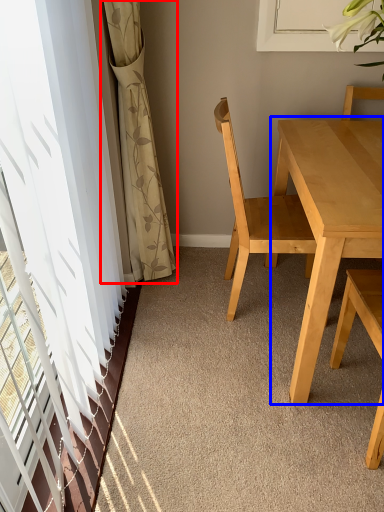
Question: Which object is further to the camera taking this photo, curtain (highlighted by a red box) or kitchen & dining room table (highlighted by a blue box)?

Choices:
 (A) curtain
 (B) kitchen & dining room table

Answer: (A)